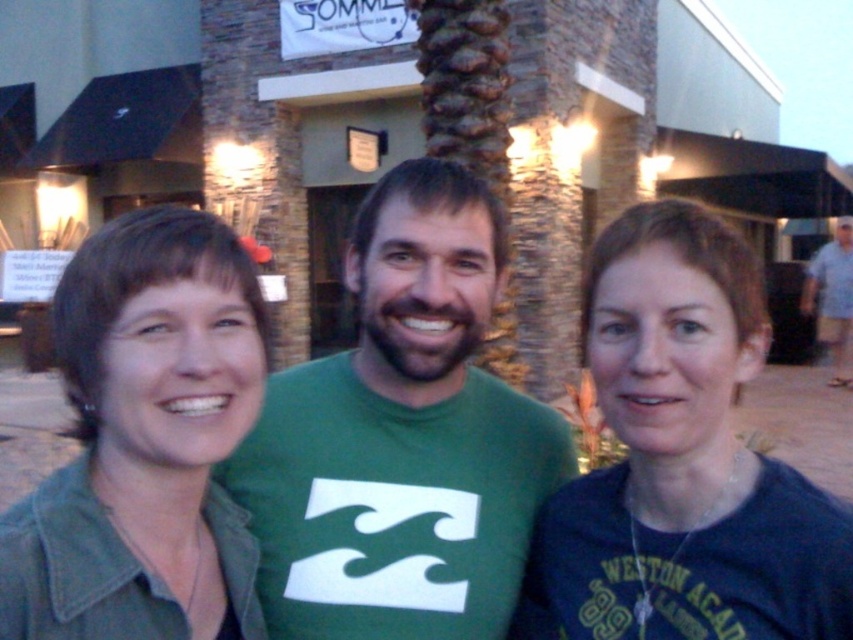
In the scene, there are three people standing in front of a building with a stone facade. The person on the left wears a green shirt over a darker top and has a necklace. The central person is in a bright green T with a wave graphic and has a beard. The rightmost person has short reddish hair. Now, a photographer wants to place a sticker exactly at point (682, 461). Which person should they target to ensure the sticker is placed on the dark blue t shirt at center?

The photographer should target the central person because the dark blue t shirt at center is located at point (682, 461).

You are standing in front of the building with the sign SOMME. There are two points marked in the image. The first point is at coordinate point [183,589] and the second point is at coordinate point [842,221]. Which point is closer to you?

Point [183,589] is closer to the viewer than point [842,221].